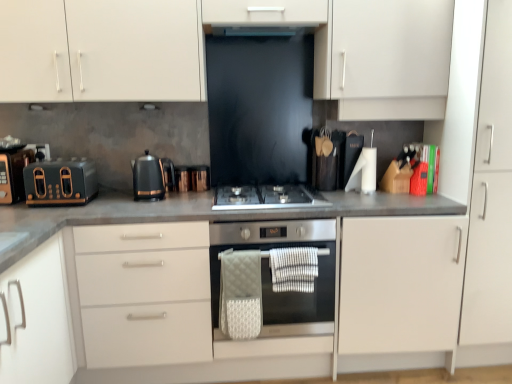
Question: In which direction should I rotate to look at white quilted hand towel at center, the 2th hand towel positioned from the right?

Choices:
 (A) left
 (B) right

Answer: (A)

Question: From the image's perspective, is white textured hand towel at center, placed as the first hand towel when sorted from right to left, above matte black toaster at left, the first kitchen appliance from the left?

Choices:
 (A) no
 (B) yes

Answer: (A)

Question: From the image's perspective, is white textured hand towel at center, placed as the first hand towel when sorted from right to left, under matte black toaster at left, the first kitchen appliance from the left?

Choices:
 (A) no
 (B) yes

Answer: (B)

Question: Is white textured hand towel at center, placed as the first hand towel when sorted from right to left, taller than matte black toaster at left, which ranks as the 2th kitchen appliance in right-to-left order?

Choices:
 (A) no
 (B) yes

Answer: (A)

Question: Is white textured hand towel at center, which appears as the second hand towel when viewed from the left, positioned behind matte black toaster at left, which ranks as the 2th kitchen appliance in right-to-left order?

Choices:
 (A) yes
 (B) no

Answer: (B)

Question: From a real-world perspective, is white textured hand towel at center, which appears as the second hand towel when viewed from the left, below matte black toaster at left, the first kitchen appliance from the left?

Choices:
 (A) no
 (B) yes

Answer: (B)

Question: Can you confirm if black metallic kettle at center, positioned as the first kitchen appliance in right-to-left order, is wider than satin silver gas stove at center?

Choices:
 (A) no
 (B) yes

Answer: (A)

Question: Is black metallic kettle at center, which appears as the second kitchen appliance when viewed from the left, thinner than satin silver gas stove at center?

Choices:
 (A) no
 (B) yes

Answer: (B)

Question: Is black metallic kettle at center, positioned as the first kitchen appliance in right-to-left order, not within satin silver gas stove at center?

Choices:
 (A) no
 (B) yes

Answer: (B)

Question: Is black metallic kettle at center, which appears as the second kitchen appliance when viewed from the left, oriented away from satin silver gas stove at center?

Choices:
 (A) yes
 (B) no

Answer: (B)

Question: Is black metallic kettle at center, which appears as the second kitchen appliance when viewed from the left, next to satin silver gas stove at center?

Choices:
 (A) yes
 (B) no

Answer: (B)

Question: From the image's perspective, is black metallic kettle at center, positioned as the first kitchen appliance in right-to-left order, below satin silver gas stove at center?

Choices:
 (A) yes
 (B) no

Answer: (B)

Question: Could you tell me if matte black toaster at left, which ranks as the 2th kitchen appliance in right-to-left order, is facing white matte cabinet at right?

Choices:
 (A) no
 (B) yes

Answer: (A)